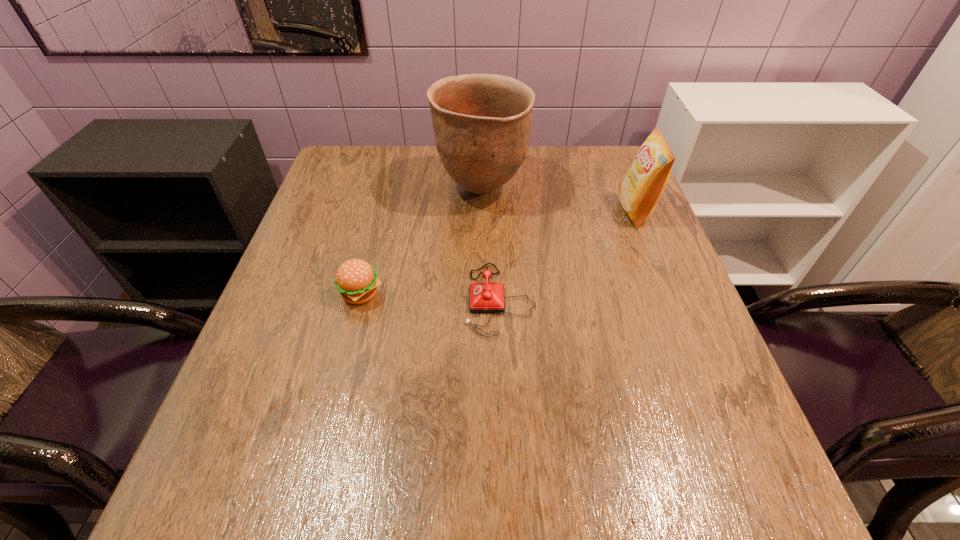
This screenshot has width=960, height=540. In order to click on the tallest object in this screenshot , I will do `click(482, 122)`.

Where is `the rightmost object`? the rightmost object is located at coordinates (640, 190).

Identify the location of crisp (potato chip). (640, 190).

At what (x,y) coordinates should I click in order to perform the action: click on the third tallest object. Please return your answer as a coordinate pair (x, y). This screenshot has height=540, width=960. Looking at the image, I should click on (356, 280).

In order to click on the leftmost object in this screenshot , I will do `click(356, 280)`.

Where is `the shortest object`? Image resolution: width=960 pixels, height=540 pixels. the shortest object is located at coordinates (487, 297).

The width and height of the screenshot is (960, 540). Find the location of `blank space located 0.150m on the right of the tallest object`. blank space located 0.150m on the right of the tallest object is located at coordinates 582,189.

Where is `vacant space located 0.120m on the front-facing side of the rightmost object`? vacant space located 0.120m on the front-facing side of the rightmost object is located at coordinates (572, 211).

Find the location of a particular element. vacant position located on the front-facing side of the rightmost object is located at coordinates (599, 211).

Identify the location of free space located on the front-facing side of the rightmost object. This screenshot has height=540, width=960. (484, 211).